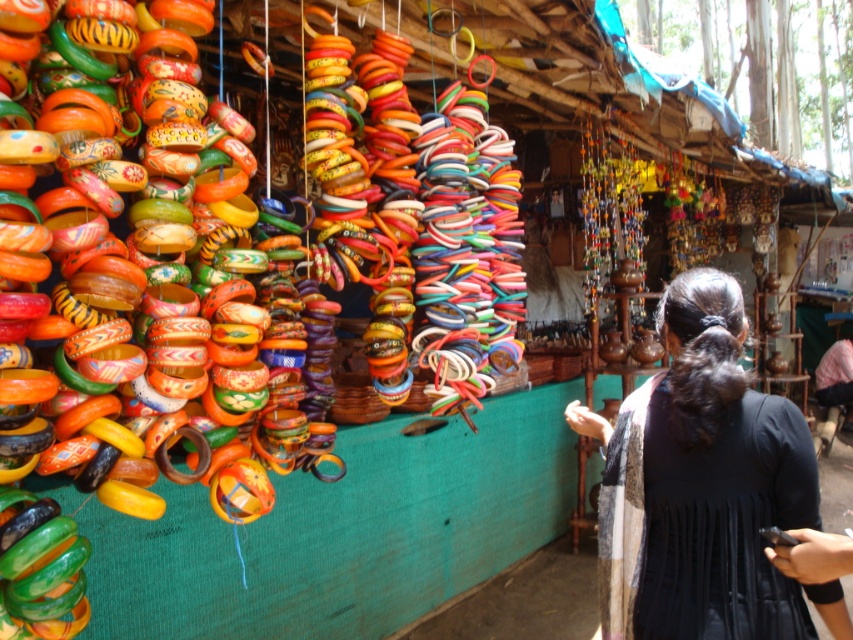
You are standing in front of the market stall and want to place a new decorative item exactly at the center of the black fabric at center. Where should you place it?

The center of the black fabric at center is located at the coordinates point (701, 484).

You are a customer at the market stall and want to pick up the matte orange bangle at center. You are currently holding the black fabric at center. Can you reach the bangle without letting go of the fabric?

The distance between the black fabric at center and the matte orange bangle at center is 13.87 inches. Since you are holding the black fabric at center, you can easily reach the matte orange bangle at center as the distance is within a comfortable arm span.